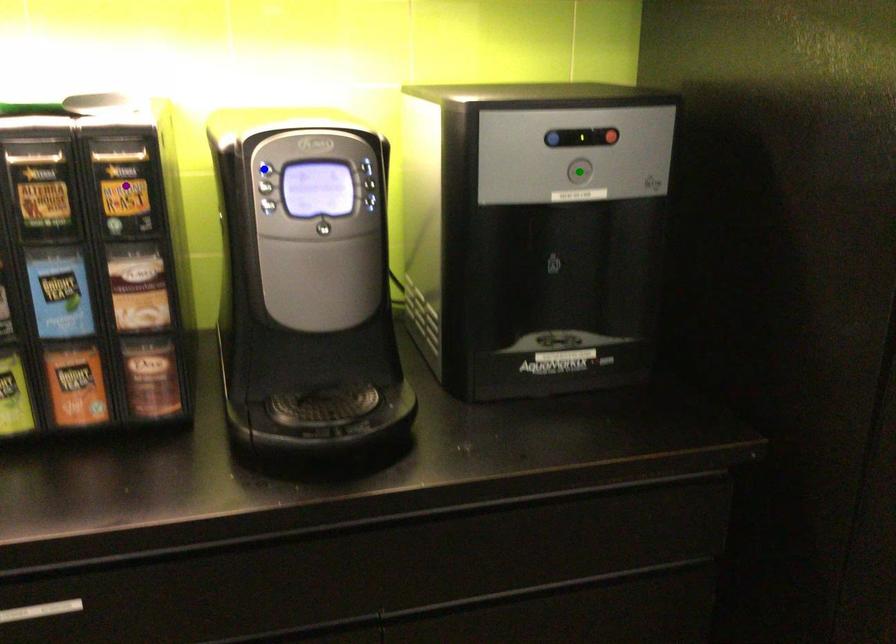
Order these from nearest to farthest:
purple point | blue point | green point

green point
purple point
blue point